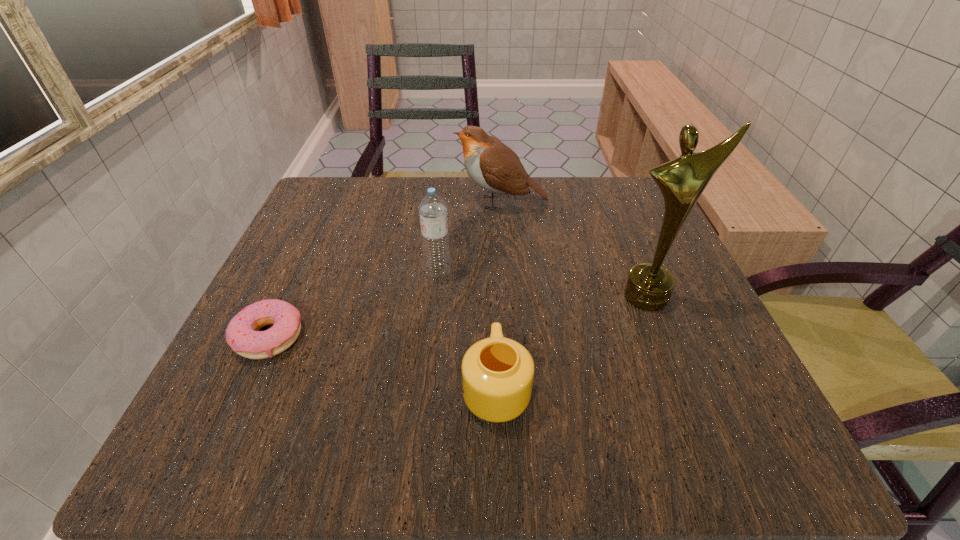
The height and width of the screenshot is (540, 960). What are the coordinates of `free space between the farthest object and the water bottle` in the screenshot? It's located at (469, 237).

Where is `blank region between the award and the shortest object`? Image resolution: width=960 pixels, height=540 pixels. blank region between the award and the shortest object is located at coordinates (459, 316).

Where is `unoccupied area between the tallest object and the second shortest object`? This screenshot has height=540, width=960. unoccupied area between the tallest object and the second shortest object is located at coordinates (572, 342).

Where is `vacant space that's between the fourth tallest object and the doughnut`? The width and height of the screenshot is (960, 540). vacant space that's between the fourth tallest object and the doughnut is located at coordinates (383, 362).

Find the location of a particular element. unoccupied position between the farthest object and the award is located at coordinates (574, 249).

Where is `empty location between the award and the farthest object`? empty location between the award and the farthest object is located at coordinates [x=574, y=249].

This screenshot has height=540, width=960. What are the coordinates of `blank region between the shortest object and the tallest object` in the screenshot? It's located at (459, 316).

Where is `the closest object relative to the shortest object`? The height and width of the screenshot is (540, 960). the closest object relative to the shortest object is located at coordinates (432, 208).

Point out which object is positioned as the second nearest to the doughnut. Please provide its 2D coordinates. Your answer should be formatted as a tuple, i.e. [(x, y)], where the tuple contains the x and y coordinates of a point satisfying the conditions above.

[(497, 372)]

In order to click on vacant space that satisfies the following two spatial constraints: 1. at the face of the bird; 2. on the front side of the fourth nearest object in this screenshot , I will do `click(506, 272)`.